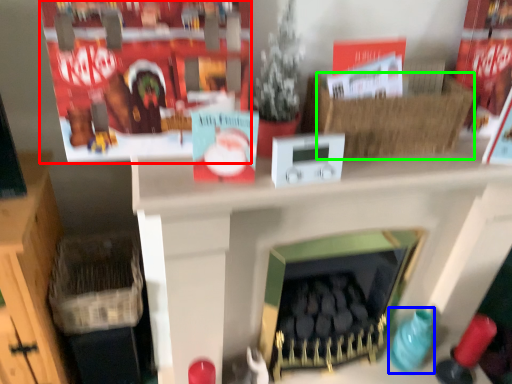
Question: Estimate the real-world distances between objects in this image. Which object is farther from shelf (highlighted by a red box), toy (highlighted by a blue box) or basket (highlighted by a green box)?

Choices:
 (A) toy
 (B) basket

Answer: (A)